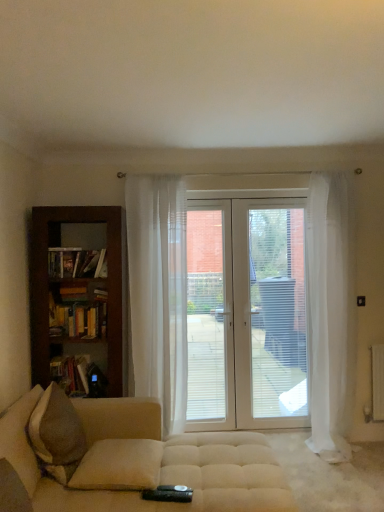
Image resolution: width=384 pixels, height=512 pixels. Find the location of `vacant space situated above wooden bookshelf at left, the 1th book viewed from the top (from a real-world perspective)`. vacant space situated above wooden bookshelf at left, the 1th book viewed from the top (from a real-world perspective) is located at coordinates (79, 302).